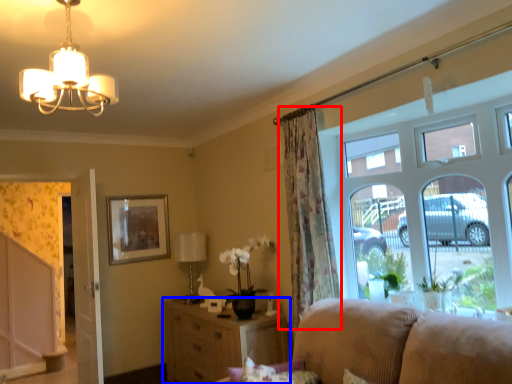
Question: Which point is closer to the camera, curtain (highlighted by a red box) or cabinetry (highlighted by a blue box)?

Choices:
 (A) curtain
 (B) cabinetry

Answer: (A)